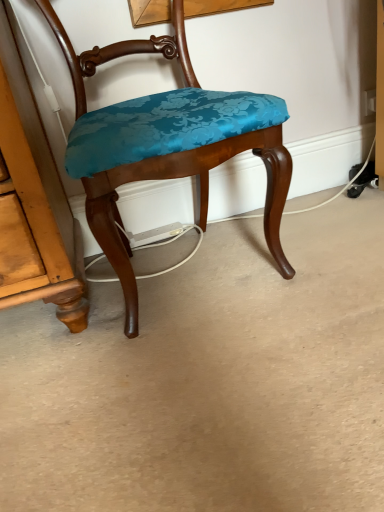
In order to face teal satin chair at center, should I rotate leftwards or rightwards?

Rotate your view left by about 3.707°.

What is the approximate height of teal satin chair at center?

The height of teal satin chair at center is 29.70 inches.

Find the location of `teal satin chair at center`. teal satin chair at center is located at coordinates (166, 144).

What do you see at coordinates (166, 144) in the screenshot? The width and height of the screenshot is (384, 512). I see `teal satin chair at center` at bounding box center [166, 144].

At what (x,y) coordinates should I click in order to perform the action: click on teal satin chair at center. Please return your answer as a coordinate pair (x, y). Looking at the image, I should click on (166, 144).